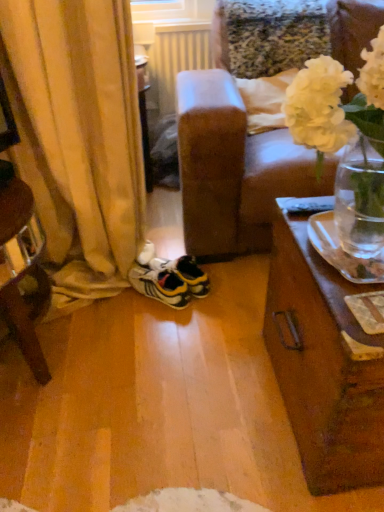
Question: Does white matte vase at upper right have a lesser width compared to white plastic radiator at upper center?

Choices:
 (A) no
 (B) yes

Answer: (A)

Question: Does white matte vase at upper right have a larger size compared to white plastic radiator at upper center?

Choices:
 (A) yes
 (B) no

Answer: (A)

Question: Is white matte vase at upper right positioned beyond the bounds of white plastic radiator at upper center?

Choices:
 (A) no
 (B) yes

Answer: (B)

Question: Is white matte vase at upper right positioned with its back to white plastic radiator at upper center?

Choices:
 (A) no
 (B) yes

Answer: (B)

Question: Can you confirm if white matte vase at upper right is positioned to the left of white plastic radiator at upper center?

Choices:
 (A) no
 (B) yes

Answer: (A)

Question: Considering the positions of white plastic radiator at upper center and white matte vase at upper right in the image, is white plastic radiator at upper center wider or thinner than white matte vase at upper right?

Choices:
 (A) wide
 (B) thin

Answer: (B)

Question: From the image's perspective, is white plastic radiator at upper center above or below white matte vase at upper right?

Choices:
 (A) below
 (B) above

Answer: (B)

Question: Considering the positions of point (170, 95) and point (352, 100), is point (170, 95) closer or farther from the camera than point (352, 100)?

Choices:
 (A) closer
 (B) farther

Answer: (B)

Question: Is white plastic radiator at upper center in front of or behind white matte vase at upper right in the image?

Choices:
 (A) behind
 (B) front

Answer: (A)

Question: From their relative heights in the image, would you say white plastic radiator at upper center is taller or shorter than yellow fabric curtain at left?

Choices:
 (A) short
 (B) tall

Answer: (A)

Question: Choose the correct answer: Is white plastic radiator at upper center inside yellow fabric curtain at left or outside it?

Choices:
 (A) inside
 (B) outside

Answer: (B)

Question: Is white plastic radiator at upper center bigger or smaller than yellow fabric curtain at left?

Choices:
 (A) big
 (B) small

Answer: (B)

Question: Is white plastic radiator at upper center wider or thinner than yellow fabric curtain at left?

Choices:
 (A) wide
 (B) thin

Answer: (B)

Question: From the image's perspective, relative to yellow fabric curtain at left, is yellow and white synthetic sneakers at center above or below?

Choices:
 (A) below
 (B) above

Answer: (A)

Question: Looking at their shapes, would you say yellow and white synthetic sneakers at center is wider or thinner than yellow fabric curtain at left?

Choices:
 (A) wide
 (B) thin

Answer: (B)